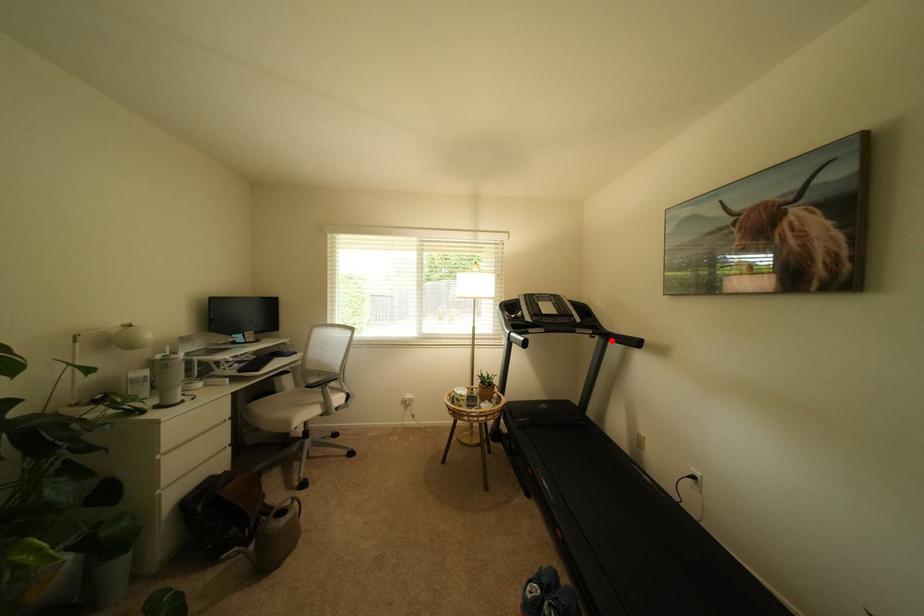
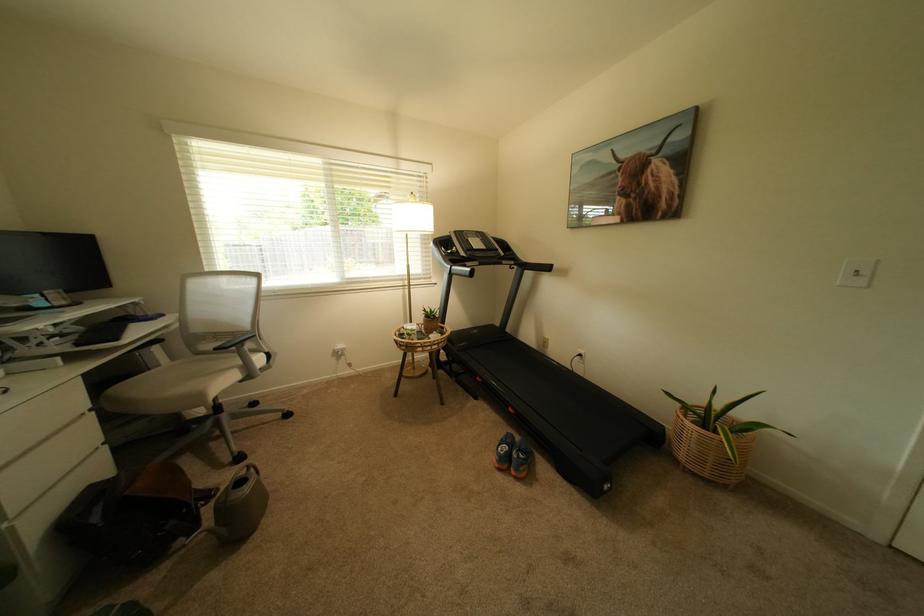
Question: I am providing you with two images of the same scene from different viewpoints. Image1 has a red point marked. In image2, the corresponding 3D location appears at what relative position? Reply with the corresponding letter.

Choices:
 (A) Closer
 (B) Farther

Answer: (A)